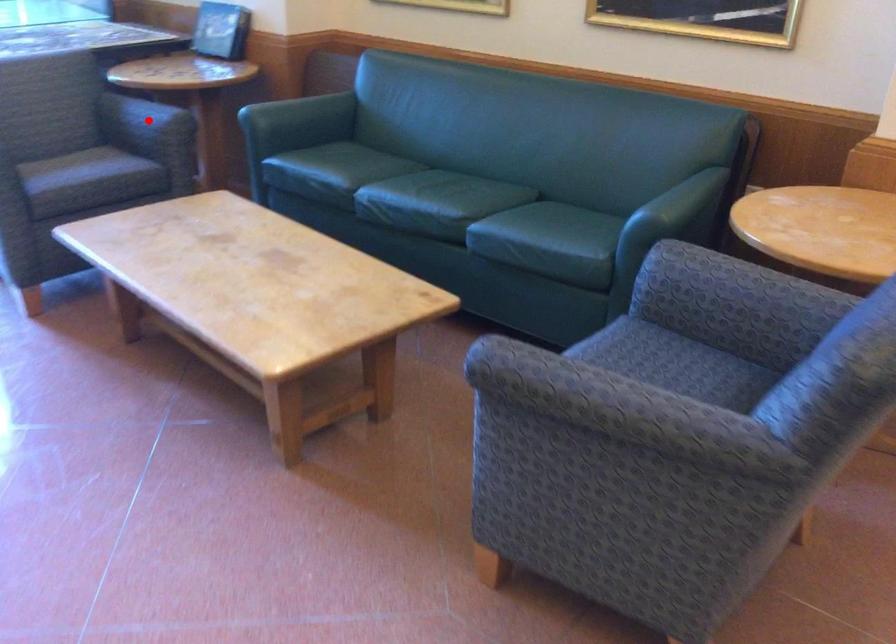
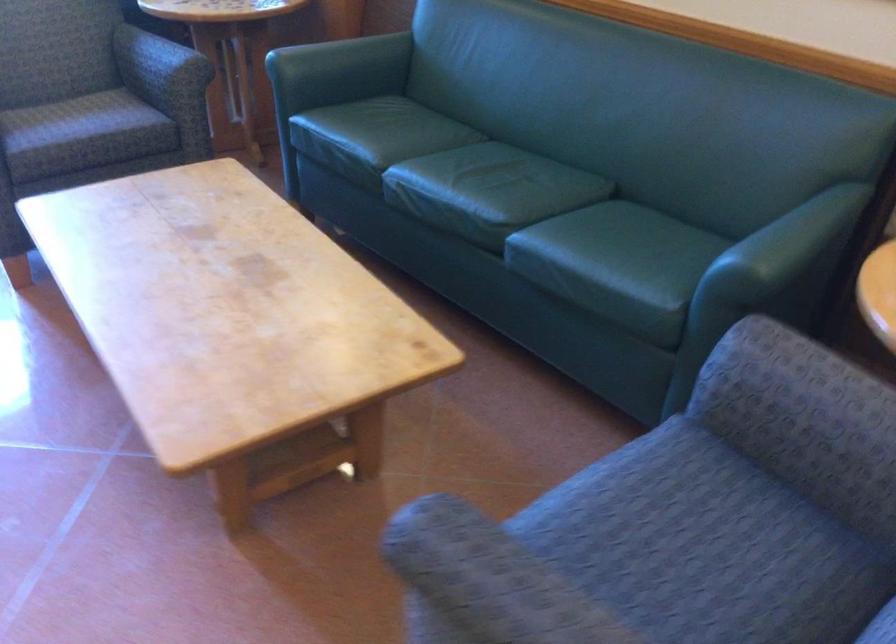
Question: I am providing you with two images of the same scene from different viewpoints. A red point is shown in image1. For the corresponding object point in image2, is it positioned nearer or farther from the camera?

Choices:
 (A) Nearer
 (B) Farther

Answer: (A)